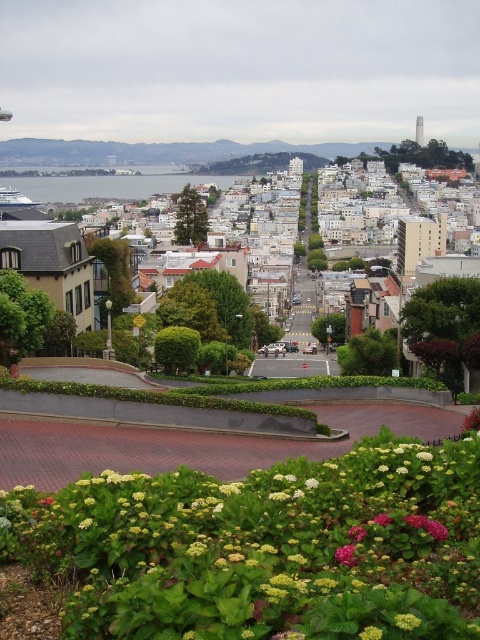
Question: Is the position of purple matte flower at center less distant than that of green leafy plant at lower right?

Choices:
 (A) no
 (B) yes

Answer: (A)

Question: Can you confirm if green leafy bush at lower center is positioned to the right of blue water at center?

Choices:
 (A) yes
 (B) no

Answer: (A)

Question: Which object appears farthest from the camera in this image?

Choices:
 (A) green leafy plant at lower right
 (B) yellow matte flower at lower center
 (C) purple matte flower at center
 (D) brown wooden houses at center

Answer: (D)

Question: Which object appears farthest from the camera in this image?

Choices:
 (A) purple matte flower at center
 (B) green leafy plant at lower right
 (C) brown wooden houses at center
 (D) yellow matte flower at lower center

Answer: (C)

Question: Which of the following is the closest to the observer?

Choices:
 (A) green leafy bush at lower center
 (B) brown wooden houses at center
 (C) yellow matte flower at lower center

Answer: (C)

Question: Does green leafy plant at lower right have a larger size compared to yellow matte flower at lower center?

Choices:
 (A) no
 (B) yes

Answer: (A)